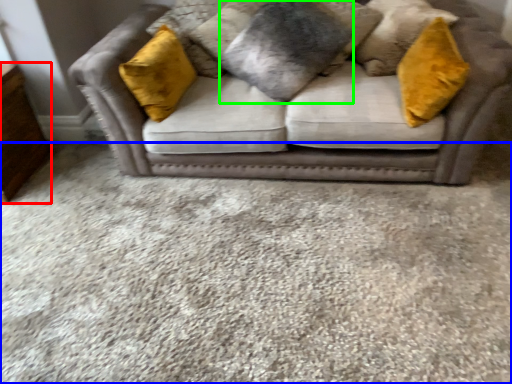
Question: Considering the real-world distances, which object is closest to dresser (highlighted by a red box)? plain (highlighted by a blue box) or pillow (highlighted by a green box).

Choices:
 (A) plain
 (B) pillow

Answer: (A)